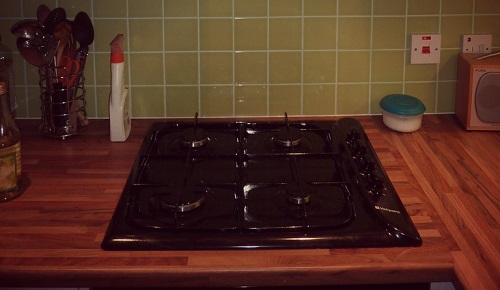
Image resolution: width=500 pixels, height=290 pixels. Identify the location of power switch. (425, 50), (483, 49).